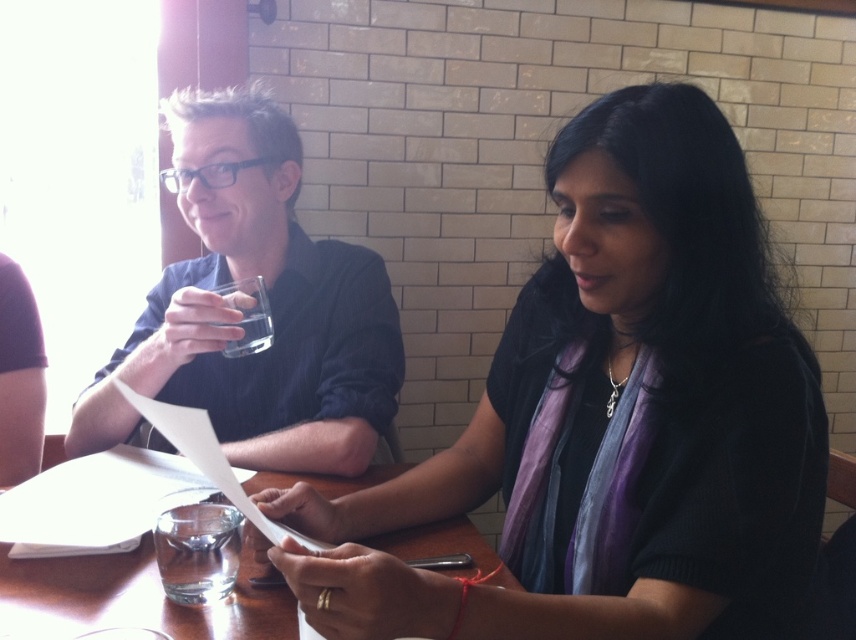
Question: In this image, where is clear glass water at table center located relative to clear glass at left?

Choices:
 (A) left
 (B) right

Answer: (B)

Question: Can you confirm if matte black shirt at left is positioned to the right of clear glass at left?

Choices:
 (A) no
 (B) yes

Answer: (A)

Question: Based on their relative distances, which object is nearer to the black matte sweater at center?

Choices:
 (A) clear glass water at table center
 (B) clear glass at left
 (C) matte black shirt at left
 (D) wooden table at center

Answer: (D)

Question: Which object appears farthest from the camera in this image?

Choices:
 (A) black matte sweater at center
 (B) clear glass water at table center
 (C) matte black shirt at left

Answer: (C)

Question: Which object is closer to the camera taking this photo?

Choices:
 (A) matte black shirt at left
 (B) clear glass at left

Answer: (A)

Question: Is black matte sweater at center smaller than clear glass water at table center?

Choices:
 (A) yes
 (B) no

Answer: (B)